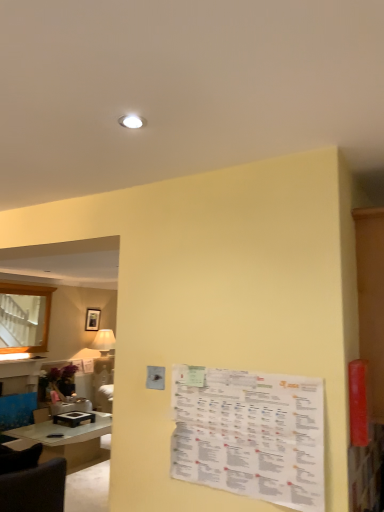
Question: Is white paper menu at center behind matte black picture frame at upper center?

Choices:
 (A) yes
 (B) no

Answer: (B)

Question: From a real-world perspective, is white paper menu at center on top of matte black picture frame at upper center?

Choices:
 (A) yes
 (B) no

Answer: (B)

Question: Considering the relative sizes of white paper menu at center and matte black picture frame at upper center in the image provided, is white paper menu at center wider than matte black picture frame at upper center?

Choices:
 (A) no
 (B) yes

Answer: (A)

Question: Does white paper menu at center have a smaller size compared to matte black picture frame at upper center?

Choices:
 (A) no
 (B) yes

Answer: (B)

Question: Is white paper menu at center oriented away from matte black picture frame at upper center?

Choices:
 (A) no
 (B) yes

Answer: (A)

Question: Are white paper menu at center and matte black picture frame at upper center making contact?

Choices:
 (A) yes
 (B) no

Answer: (B)

Question: From a real-world perspective, is matte black picture frame at upper center below white paper menu at center?

Choices:
 (A) yes
 (B) no

Answer: (B)

Question: Is white paper menu at center at the back of matte black picture frame at upper center?

Choices:
 (A) no
 (B) yes

Answer: (A)

Question: Is matte black picture frame at upper center next to white paper menu at center and touching it?

Choices:
 (A) yes
 (B) no

Answer: (B)

Question: From a real-world perspective, does matte black picture frame at upper center stand above white paper menu at center?

Choices:
 (A) yes
 (B) no

Answer: (A)

Question: Is matte black picture frame at upper center taller than white paper menu at center?

Choices:
 (A) yes
 (B) no

Answer: (B)

Question: Does matte black picture frame at upper center have a lesser height compared to white paper menu at center?

Choices:
 (A) no
 (B) yes

Answer: (B)

Question: Is clear glass table at lower left oriented away from matte black picture frame at upper center?

Choices:
 (A) yes
 (B) no

Answer: (B)